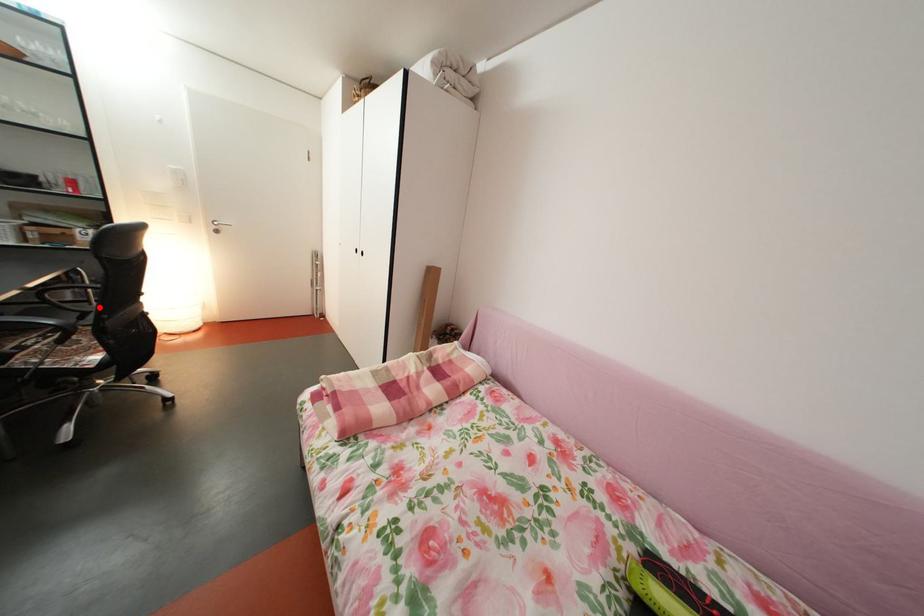
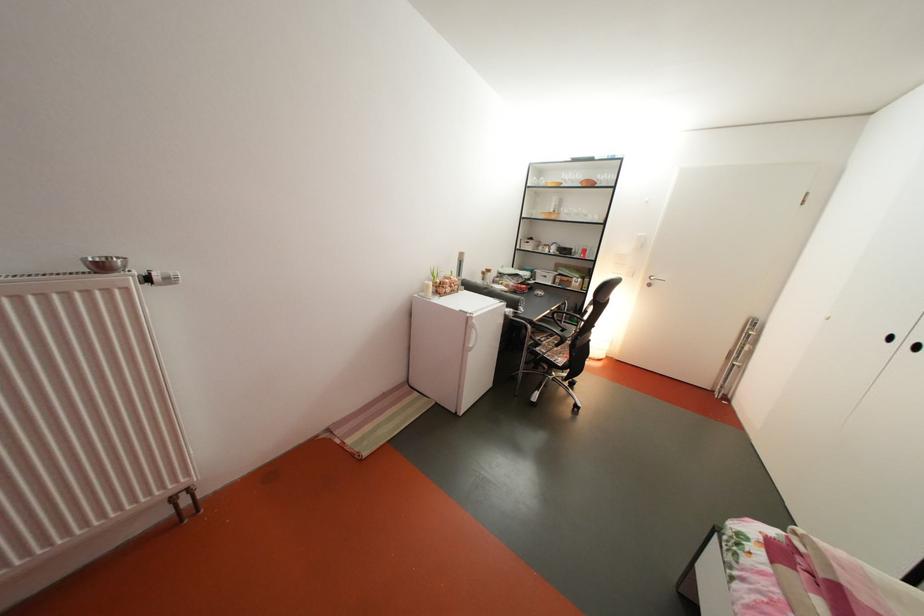
Locate, in the second image, the point that corresponds to the highlighted location in the first image.

(573, 328)